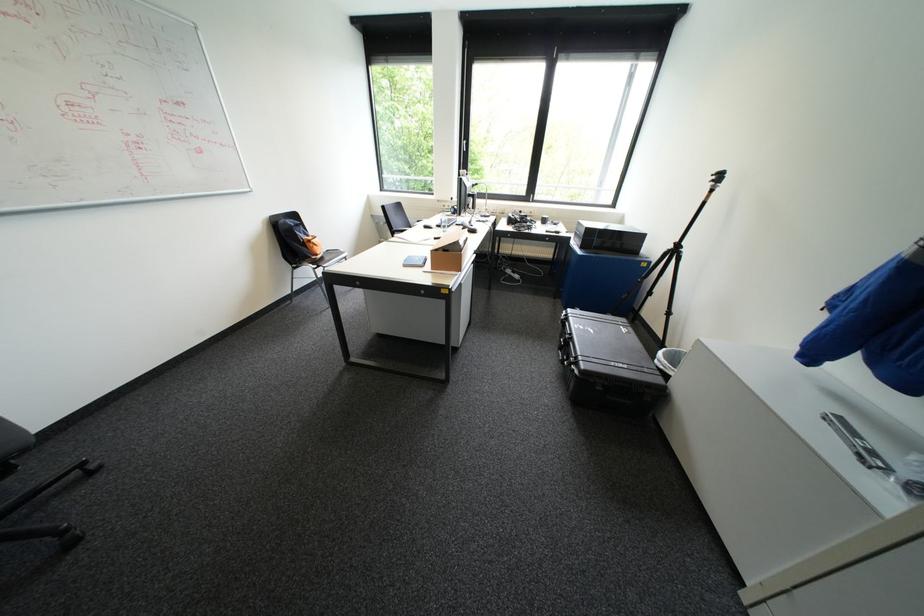
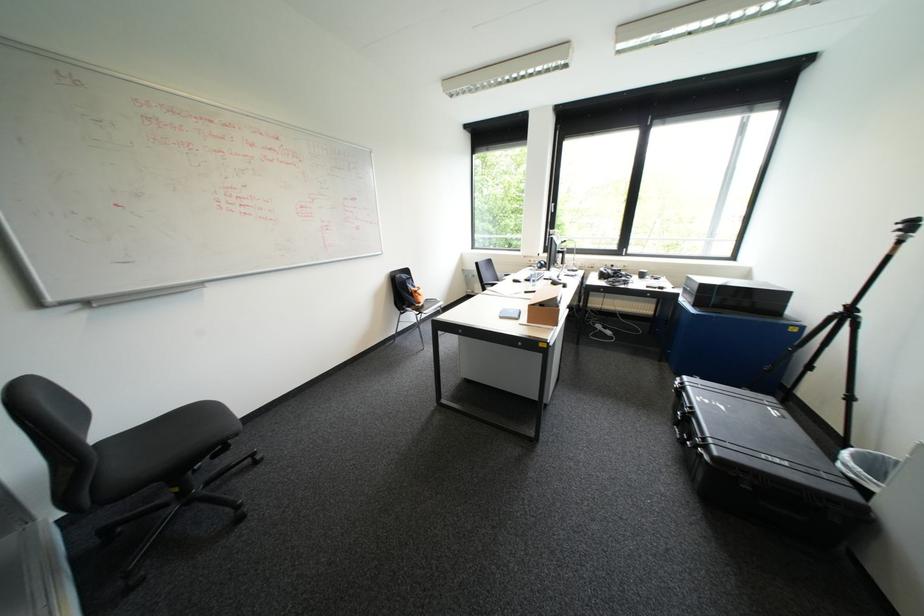
In the scene shown: In a continuous first-person perspective shot, in which direction is the camera moving?

The cameraman moved toward left, backward.